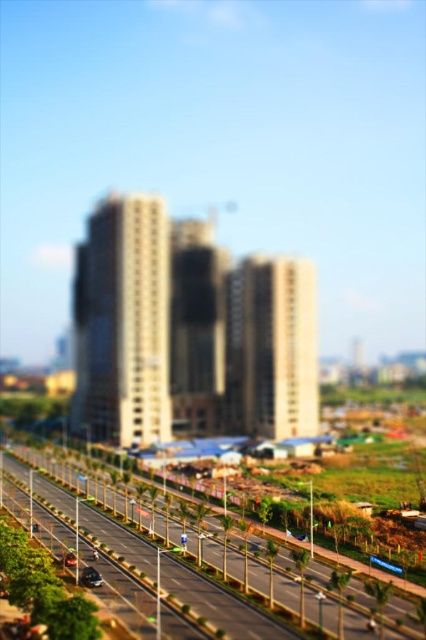
Question: Which object appears closest to the camera in this image?

Choices:
 (A) shiny black car at center
 (B) shiny black car at lower left

Answer: (B)

Question: Can you confirm if shiny black car at lower left is thinner than shiny black car at center?

Choices:
 (A) no
 (B) yes

Answer: (A)

Question: Does asphalt road at center appear on the right side of shiny black car at center?

Choices:
 (A) yes
 (B) no

Answer: (A)

Question: Can you confirm if shiny black car at lower left is positioned above shiny black car at center?

Choices:
 (A) no
 (B) yes

Answer: (B)

Question: Among these points, which one is nearest to the camera?

Choices:
 (A) pos(45,520)
 (B) pos(88,586)

Answer: (B)

Question: Which point is closer to the camera?

Choices:
 (A) (109, 576)
 (B) (71, 552)
 (C) (100, 579)

Answer: (C)